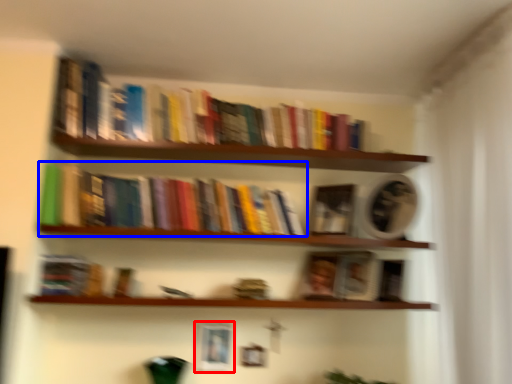
Question: Which of the following is the closest to the observer, picture frame (highlighted by a red box) or book (highlighted by a blue box)?

Choices:
 (A) picture frame
 (B) book

Answer: (B)